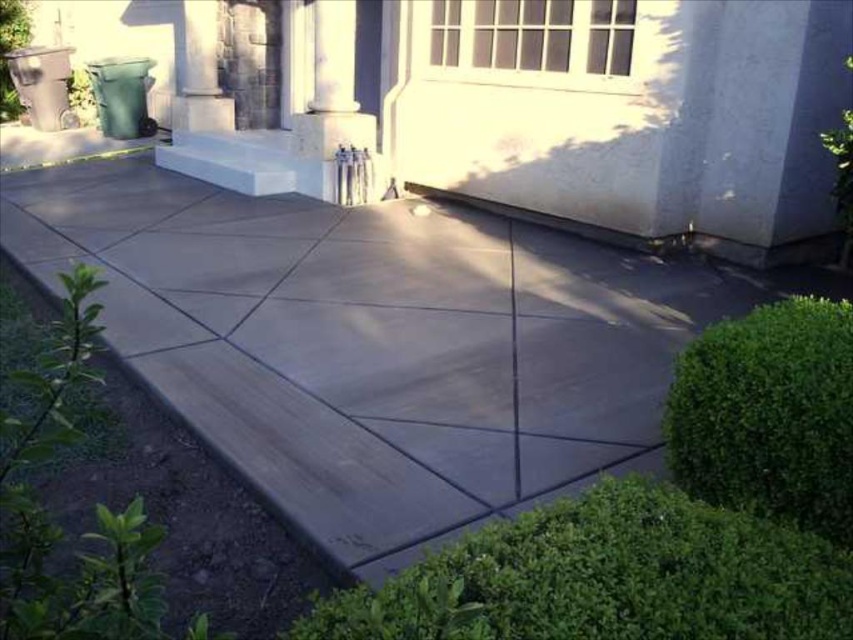
Looking at this image, is green leafy hedge at lower right shorter than white textured window at upper center?

Correct, green leafy hedge at lower right is not as tall as white textured window at upper center.

The image size is (853, 640). What do you see at coordinates (608, 577) in the screenshot?
I see `green leafy hedge at lower right` at bounding box center [608, 577].

Where is `green leafy hedge at lower right`? The width and height of the screenshot is (853, 640). green leafy hedge at lower right is located at coordinates (608, 577).

Does green leafy bush at lower right have a larger size compared to white smooth column at upper center?

Yes.

Between point (825, 490) and point (352, 106), which one is positioned behind?

The point (352, 106) is more distant.

At what (x,y) coordinates should I click in order to perform the action: click on green leafy bush at lower right. Please return your answer as a coordinate pair (x, y). This screenshot has width=853, height=640. Looking at the image, I should click on (769, 413).

Identify the location of green leafy bush at lower right. (769, 413).

Is green leafy hedge at lower right positioned at the back of green leafy bush at lower right?

That is False.

Does green leafy hedge at lower right appear over green leafy bush at lower right?

Incorrect, green leafy hedge at lower right is not positioned above green leafy bush at lower right.

Where is `green leafy hedge at lower right`? Image resolution: width=853 pixels, height=640 pixels. green leafy hedge at lower right is located at coordinates (608, 577).